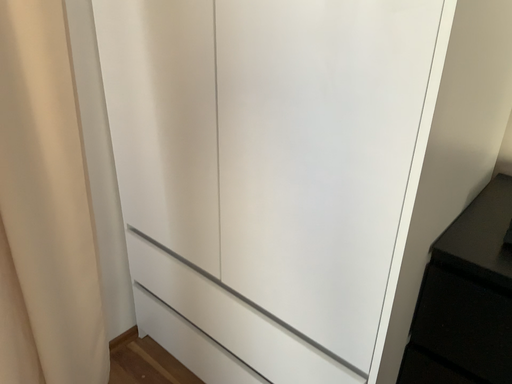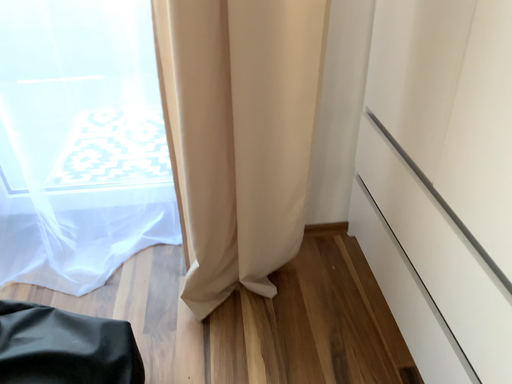
Question: How did the camera likely rotate when shooting the video?

Choices:
 (A) rotated left
 (B) rotated right

Answer: (A)